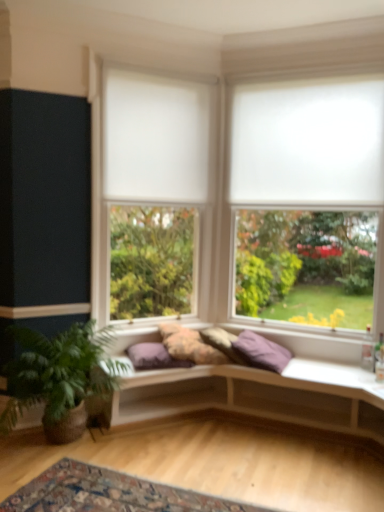
Identify the location of blank space situated above white matte window at center, which is the 2th window in right-to-left order (from a real-world perspective). The width and height of the screenshot is (384, 512). (150, 48).